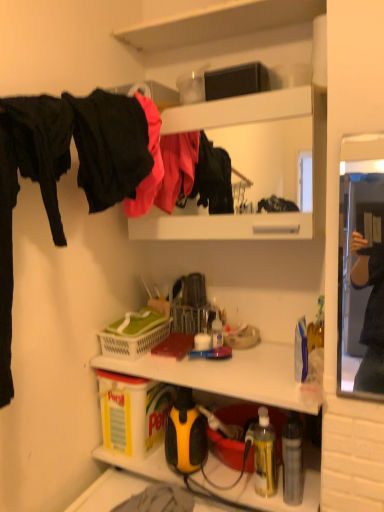
Locate an element on the screen. The height and width of the screenshot is (512, 384). vacant space situated on the left part of translucent yellow bottle at lower right, marked as the first bottle in a left-to-right arrangement is located at coordinates (220, 484).